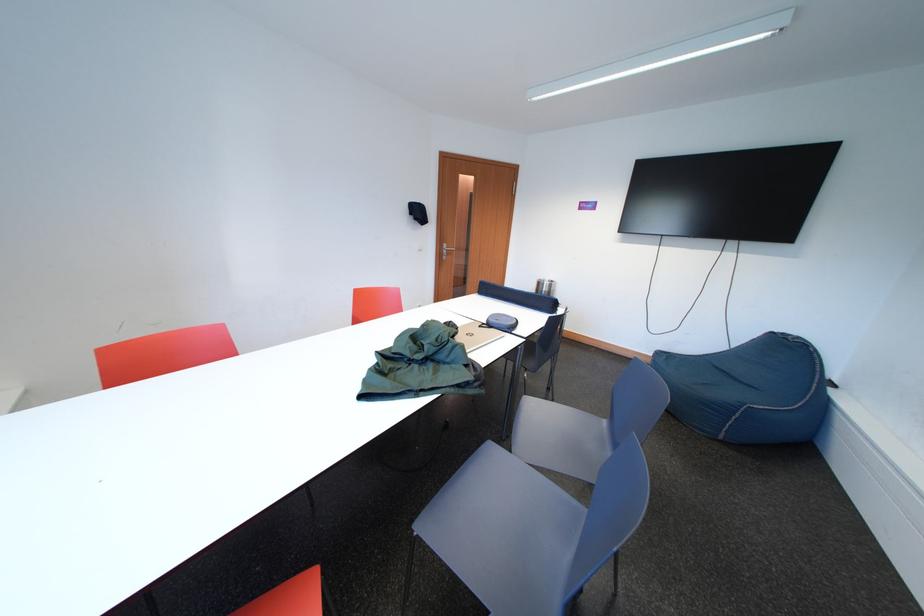
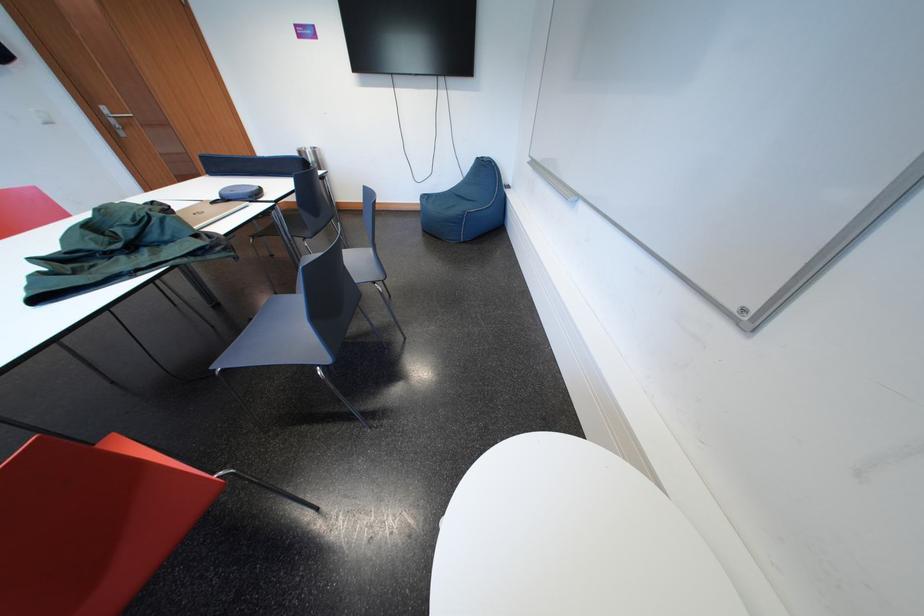
Find the pixel in the second image that matches point (549, 288) in the first image.

(310, 158)